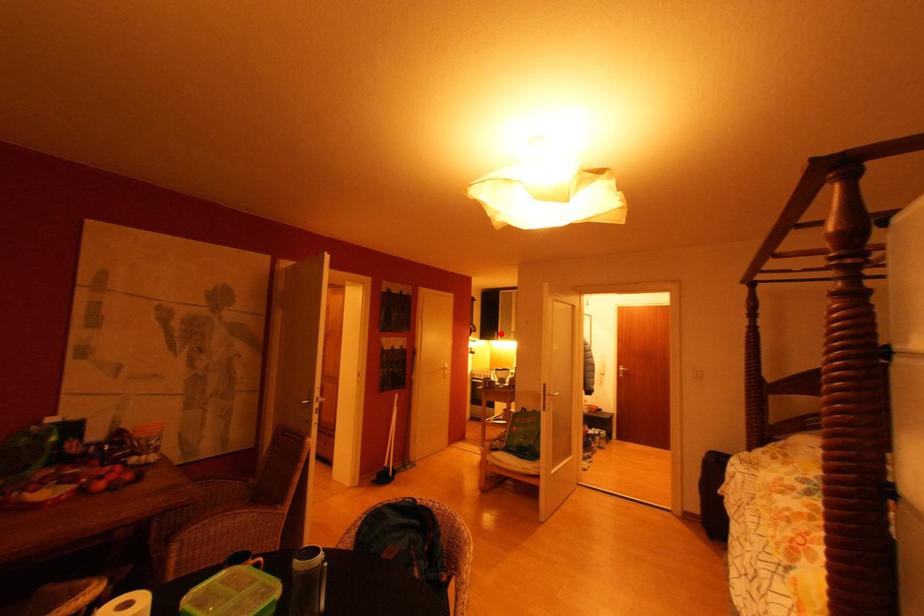
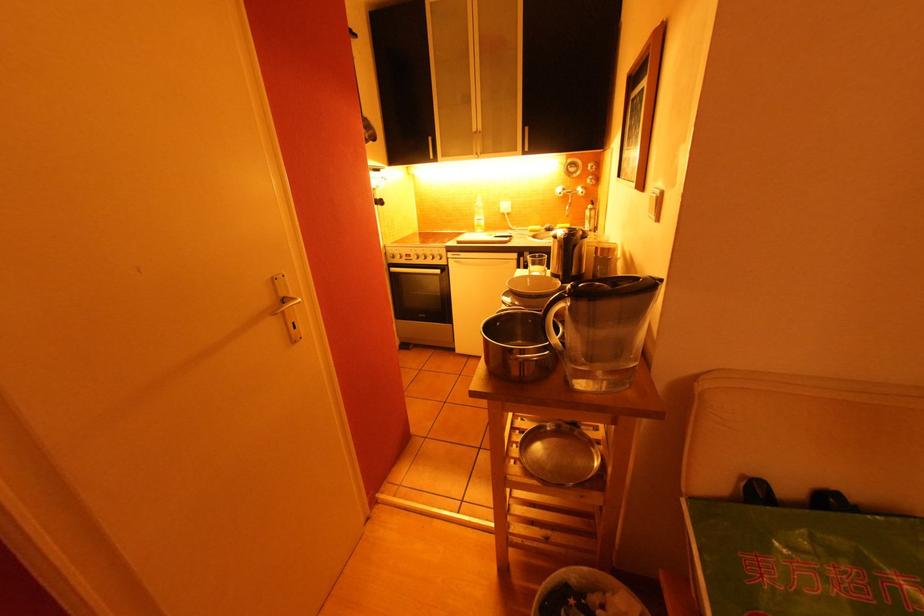
Question: I am providing you with two images of the same scene from different viewpoints. A red point is shown in image1. For the corresponding object point in image2, is it positioned nearer or farther from the camera?

Choices:
 (A) Nearer
 (B) Farther

Answer: (A)